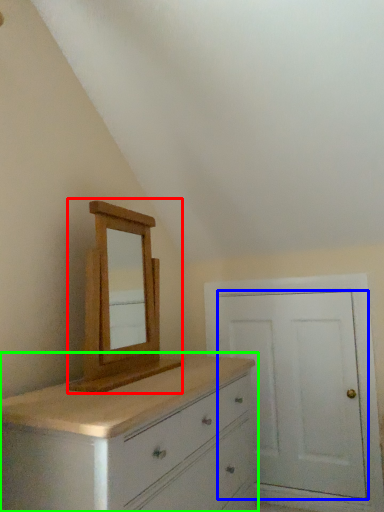
Question: Estimate the real-world distances between objects in this image. Which object is farther from medicine cabinet (highlighted by a red box), door (highlighted by a blue box) or chest of drawers (highlighted by a green box)?

Choices:
 (A) door
 (B) chest of drawers

Answer: (A)